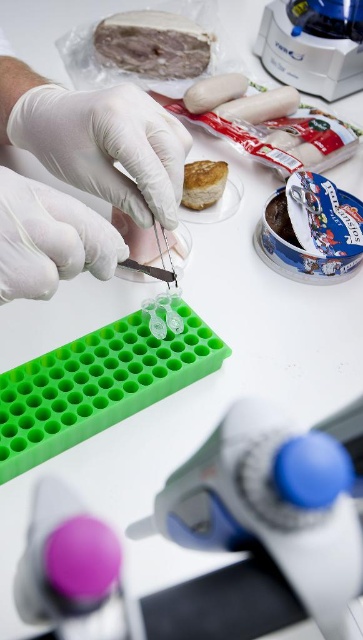
Question: Is blue plastic pipette at center thinner than golden brown flaky pastry at upper right?

Choices:
 (A) no
 (B) yes

Answer: (A)

Question: Observing the image, what is the correct spatial positioning of white rubber glove at center in reference to white glossy sausage at center?

Choices:
 (A) right
 (B) left

Answer: (B)

Question: Based on their relative distances, which object is farther from the semi-translucent pinkish meat at upper center?

Choices:
 (A) golden brown flaky pastry at upper right
 (B) white matte gloves at upper left
 (C) white glossy sausage at center

Answer: (B)

Question: Estimate the real-world distances between objects in this image. Which object is closer to the semi-translucent pinkish meat at upper center?

Choices:
 (A) golden brown flaky pastry at upper right
 (B) white glossy sausage at center
 (C) chocolate matte cake at right

Answer: (B)

Question: Which point is closer to the camera?

Choices:
 (A) white glossy sausage at center
 (B) golden brown flaky pastry at upper right

Answer: (B)

Question: Does semi-translucent pinkish meat at upper center appear under golden brown flaky pastry at upper right?

Choices:
 (A) no
 (B) yes

Answer: (A)